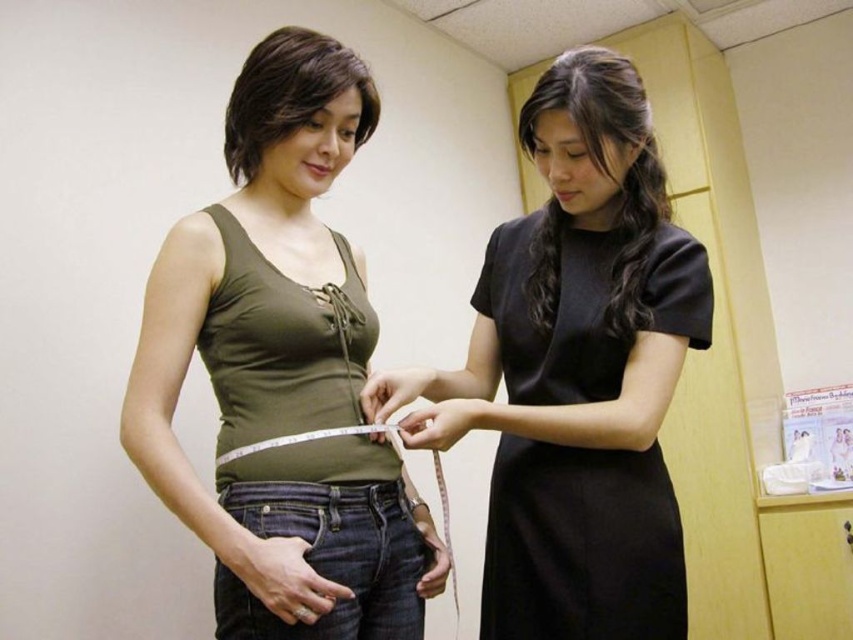
Question: Does matte green tank top at center have a lesser width compared to black satin dress at upper right?

Choices:
 (A) no
 (B) yes

Answer: (A)

Question: Observing the image, what is the correct spatial positioning of matte green tank top at center in reference to black satin dress at upper right?

Choices:
 (A) above
 (B) below

Answer: (A)

Question: Which of the following is the closest to the observer?

Choices:
 (A) (589, 260)
 (B) (289, 566)

Answer: (B)

Question: Which point is closer to the camera?

Choices:
 (A) black satin dress at center
 (B) black satin dress at upper right
 (C) matte green tank top at center

Answer: (C)

Question: Is black satin dress at center thinner than black satin dress at upper right?

Choices:
 (A) yes
 (B) no

Answer: (B)

Question: Which point is farther to the camera?

Choices:
 (A) click(x=682, y=324)
 (B) click(x=688, y=288)
 (C) click(x=326, y=502)

Answer: (B)